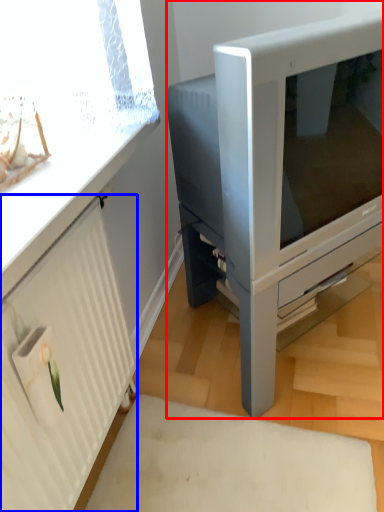
Question: Which point is closer to the camera, furniture (highlighted by a red box) or radiator (highlighted by a blue box)?

Choices:
 (A) furniture
 (B) radiator

Answer: (B)